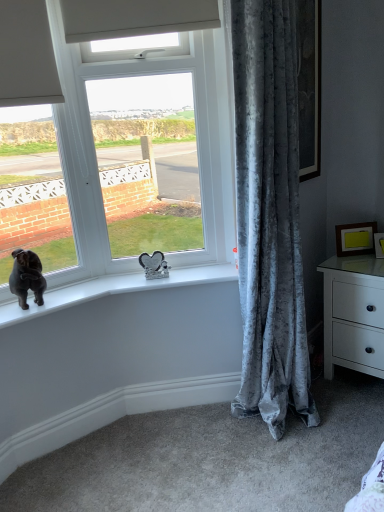
At what (x,y) coordinates should I click in order to perform the action: click on vacant area in front of black velvet dog at window. Please return your answer as a coordinate pair (x, y). Looking at the image, I should click on (20, 312).